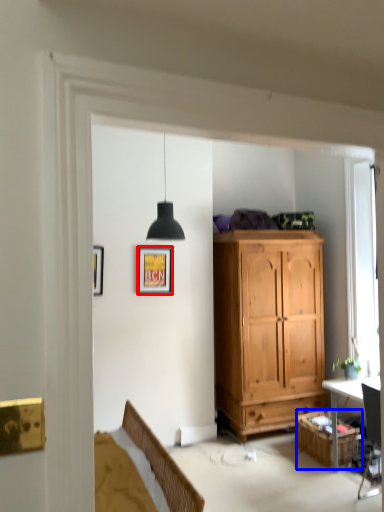
Question: Which point is closer to the camera, picture frame (highlighted by a red box) or cabinetry (highlighted by a blue box)?

Choices:
 (A) picture frame
 (B) cabinetry

Answer: (B)